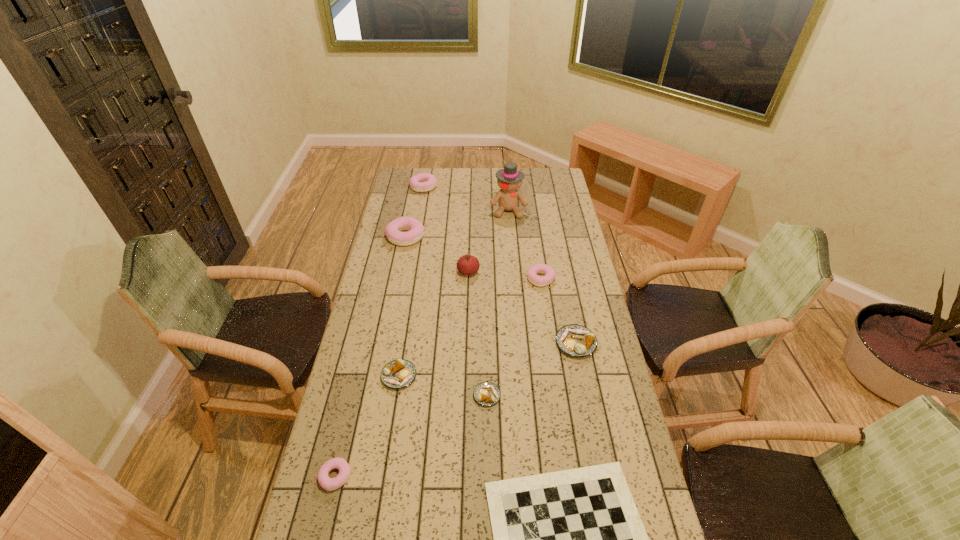
The height and width of the screenshot is (540, 960). In order to click on free region located 0.090m on the front of the third smallest pink pastry in this screenshot , I will do (x=420, y=204).

This screenshot has height=540, width=960. Find the location of `vacant point located on the left of the rightmost brown pastry`. vacant point located on the left of the rightmost brown pastry is located at coordinates (459, 343).

What are the coordinates of `blank area located 0.050m on the left of the rightmost pink pastry` in the screenshot? It's located at (515, 279).

The width and height of the screenshot is (960, 540). Find the location of `vacant space located 0.060m on the right of the leftmost brown pastry`. vacant space located 0.060m on the right of the leftmost brown pastry is located at coordinates (435, 376).

Locate an element on the screen. The image size is (960, 540). vacant space situated 0.250m on the right of the nearest pastry is located at coordinates (440, 476).

Locate an element on the screen. vacant space located on the back of the second brown pastry from right to left is located at coordinates (486, 333).

I want to click on object that is at the far edge, so click(423, 182).

At what (x,y) coordinates should I click in order to perform the action: click on object located in the far left corner section of the desktop. Please return your answer as a coordinate pair (x, y). Looking at the image, I should click on (423, 182).

This screenshot has height=540, width=960. Find the location of `vacant area at the far edge of the desktop`. vacant area at the far edge of the desktop is located at coordinates (528, 176).

What are the coordinates of `vacant space at the left edge of the desktop` in the screenshot? It's located at (396, 287).